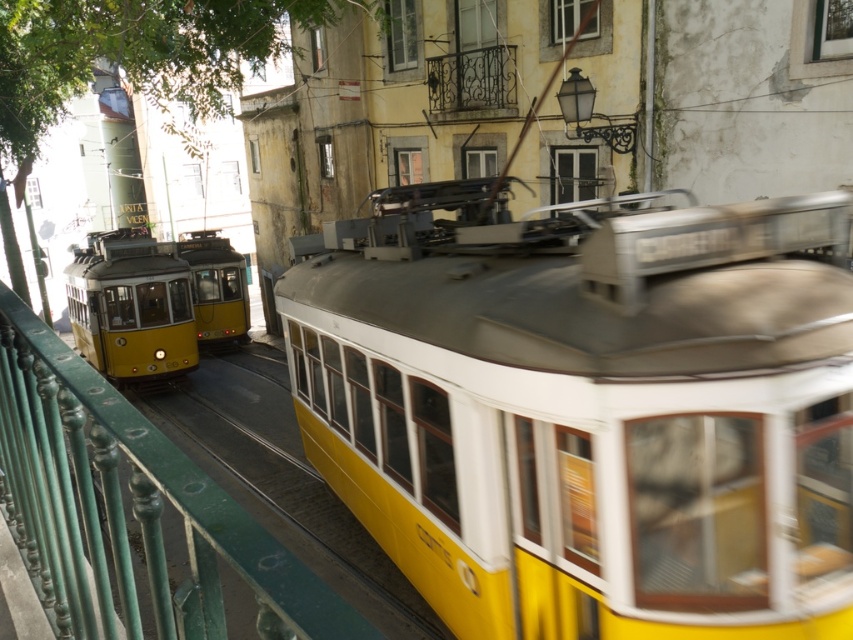
You are a city planner designing a new tram system and want to ensure the green polished metal rail at center can accommodate the yellow matte tram at left. Based on the scene, will the rail at center be wide enough for the tram?

The green polished metal rail at center has a width larger than the yellow matte tram at left, so the rail is wide enough to accommodate the tram.

You are a delivery person needing to move a package from the yellow matte train at center to the green polished metal rail at center. The package requires a clear path with at least 2.5 meters of space between them. Can you safely move the package without any obstruction?

The yellow matte train at center and green polished metal rail at center are 2.64 meters apart, which is more than the required 2.5 meters. Therefore, you can safely move the package without any obstruction.

You are a photographer standing on the street and want to capture a photo of the yellow matte train at center and the green polished metal rail at center. Which object should you focus on first to ensure it appears sharp in the photo?

The yellow matte train at center is further to the viewer than the green polished metal rail at center, so you should focus on the yellow matte train at center first to ensure it appears sharp in the photo.